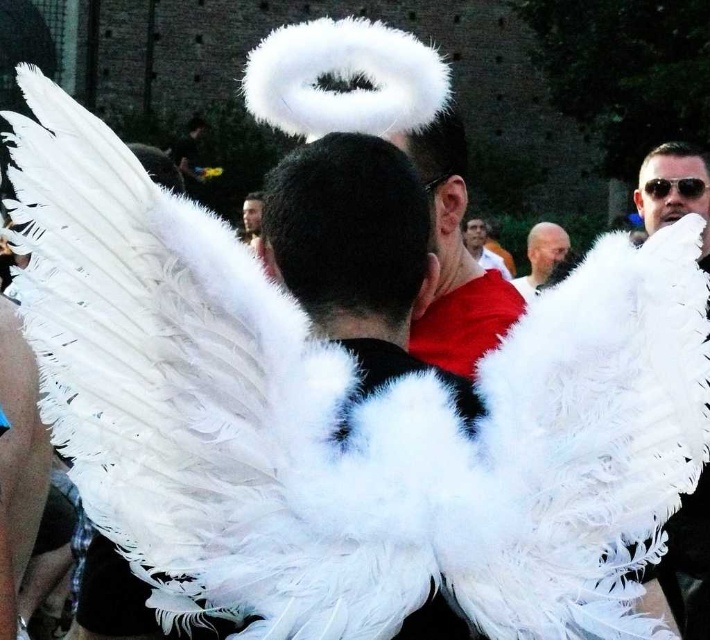
Which is more to the right, white feathered wings at upper center or smooth white wings at center?

white feathered wings at upper center

Does white feathered wings at upper center have a greater width compared to smooth white wings at center?

Correct, the width of white feathered wings at upper center exceeds that of smooth white wings at center.

This screenshot has height=640, width=710. Identify the location of white feathered wings at upper center. (674, 188).

Where is `white feathered wings at upper center`? This screenshot has width=710, height=640. white feathered wings at upper center is located at coordinates (674, 188).

Who is positioned more to the right, bald head at center or sunglasses at upper right?

sunglasses at upper right

Measure the distance from bald head at center to sunglasses at upper right.

A distance of 24.28 meters exists between bald head at center and sunglasses at upper right.

You are a GUI agent. You are given a task and a screenshot of the screen. Output one action in this format:
    pyautogui.click(x=<x>, y=<y>)
    Task: Click on the bald head at center
    
    Given the screenshot: What is the action you would take?
    pyautogui.click(x=540, y=257)

Where is `bald head at center`? This screenshot has height=640, width=710. bald head at center is located at coordinates (540, 257).

Who is positioned more to the left, white feathered wings at upper center or smooth skin face at center?

smooth skin face at center is more to the left.

Between white feathered wings at upper center and smooth skin face at center, which one has more height?

white feathered wings at upper center is taller.

Image resolution: width=710 pixels, height=640 pixels. What do you see at coordinates (674, 188) in the screenshot?
I see `white feathered wings at upper center` at bounding box center [674, 188].

Image resolution: width=710 pixels, height=640 pixels. In order to click on white feathered wings at upper center in this screenshot , I will do `click(674, 188)`.